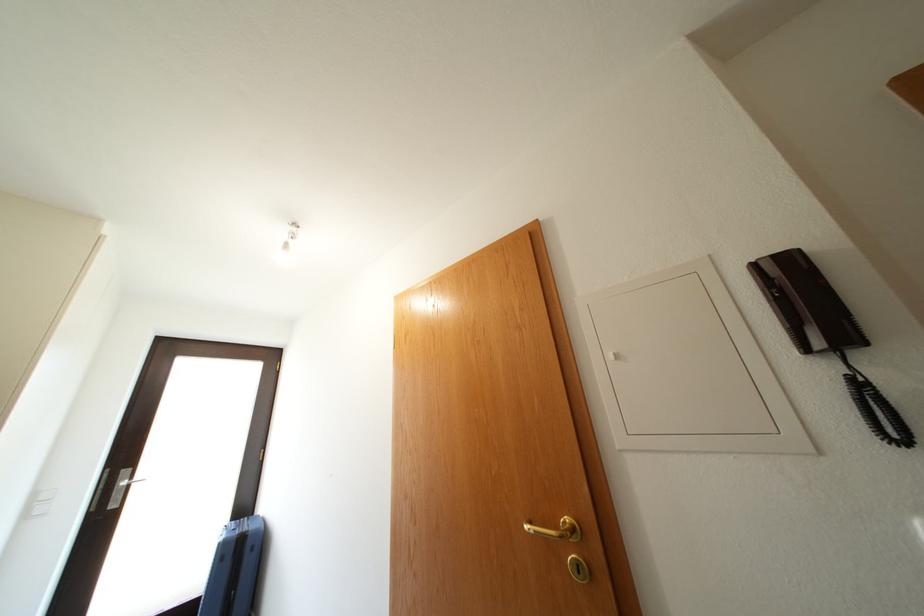
Find the location of a particular element. This screenshot has width=924, height=616. white panel knob is located at coordinates (613, 355).